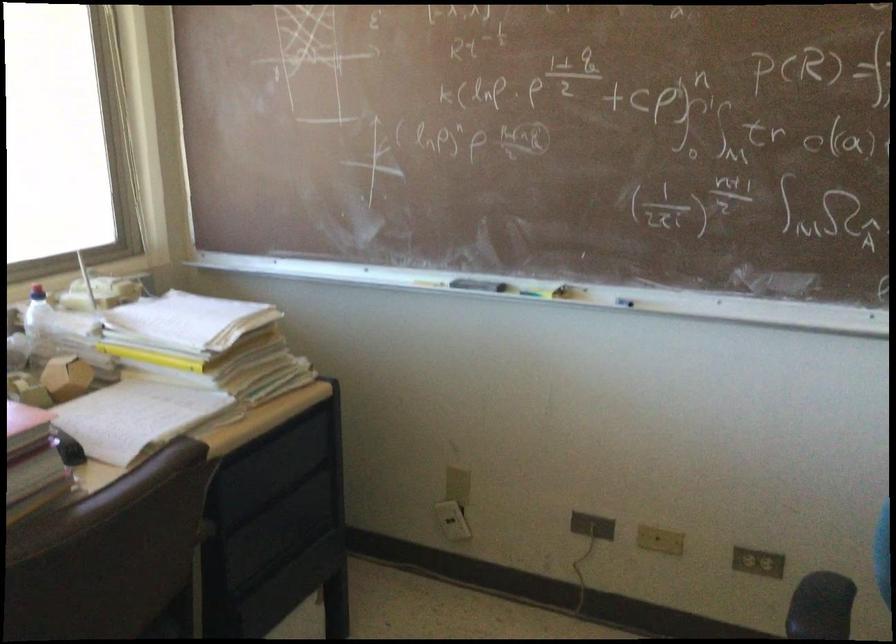
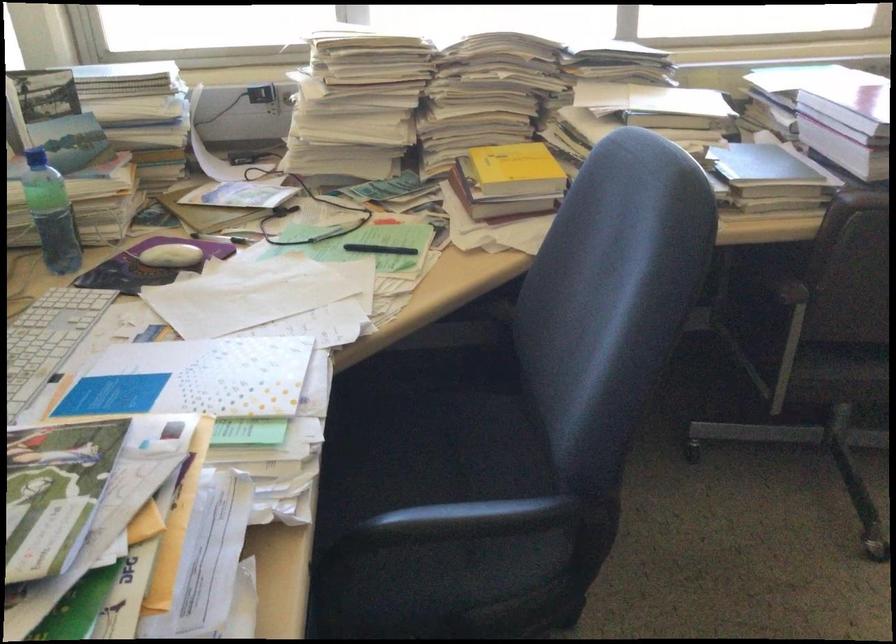
The images are taken continuously from a first-person perspective. In which direction is your viewpoint rotating?

The camera rotated toward left-down.